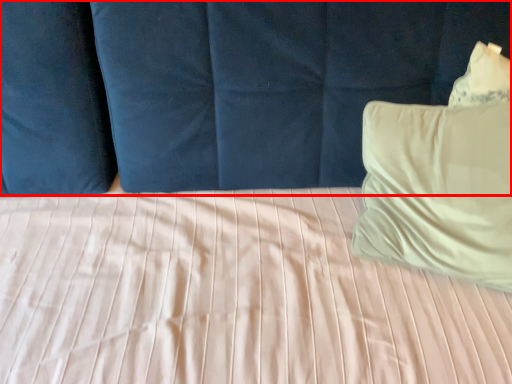
Question: Observing the image, what is the correct spatial positioning of curtain (annotated by the red box) in reference to pillow?

Choices:
 (A) right
 (B) left

Answer: (B)